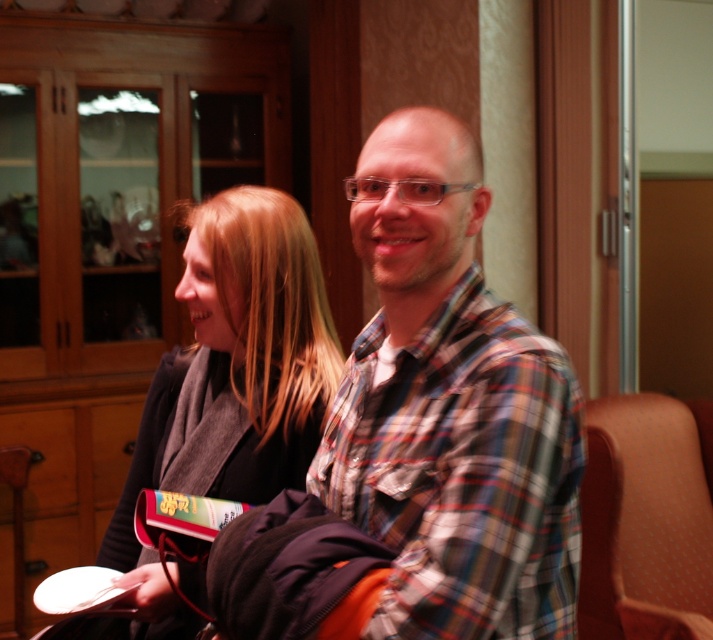
Question: Observing the image, what is the correct spatial positioning of plaid shirt at center in reference to matte black jacket at center?

Choices:
 (A) above
 (B) below

Answer: (B)

Question: Estimate the real-world distances between objects in this image. Which object is closer to the matte black jacket at center?

Choices:
 (A) plaid shirt at center
 (B) orange fabric chair at right

Answer: (A)

Question: Is the position of plaid shirt at center more distant than that of orange fabric chair at right?

Choices:
 (A) yes
 (B) no

Answer: (B)

Question: Which point is closer to the camera taking this photo?

Choices:
 (A) (337, 442)
 (B) (329, 353)

Answer: (A)

Question: Which of these objects is positioned farthest from the orange fabric chair at right?

Choices:
 (A) plaid shirt at center
 (B) matte black jacket at center

Answer: (A)

Question: Does plaid shirt at center appear on the right side of matte black jacket at center?

Choices:
 (A) no
 (B) yes

Answer: (B)